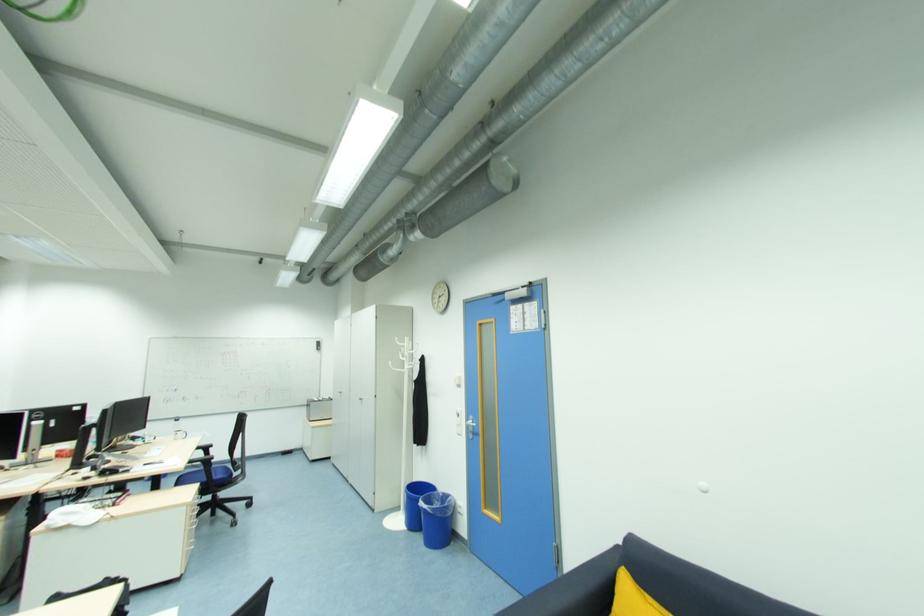
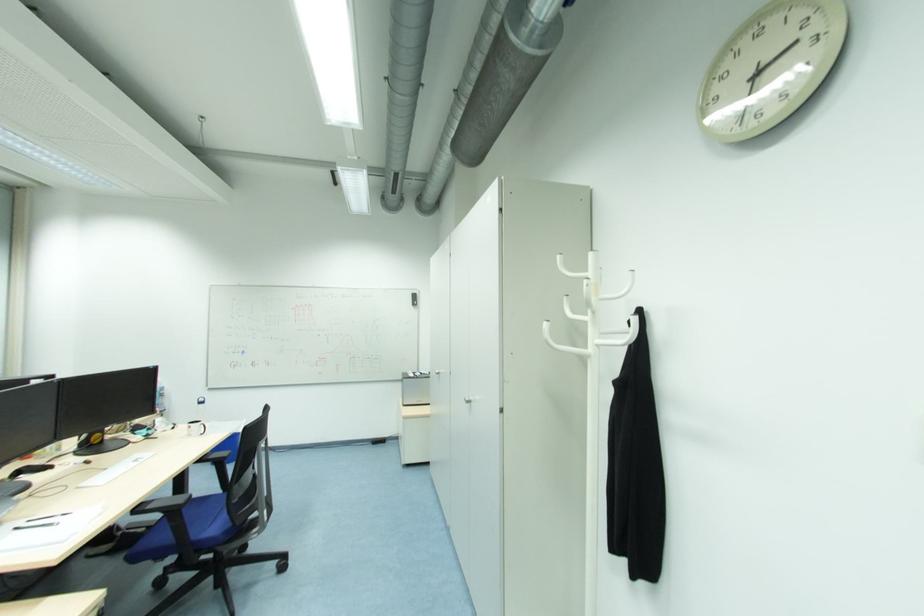
Find the pixel in the second image that matches the point at 322,345 in the first image.

(417, 298)